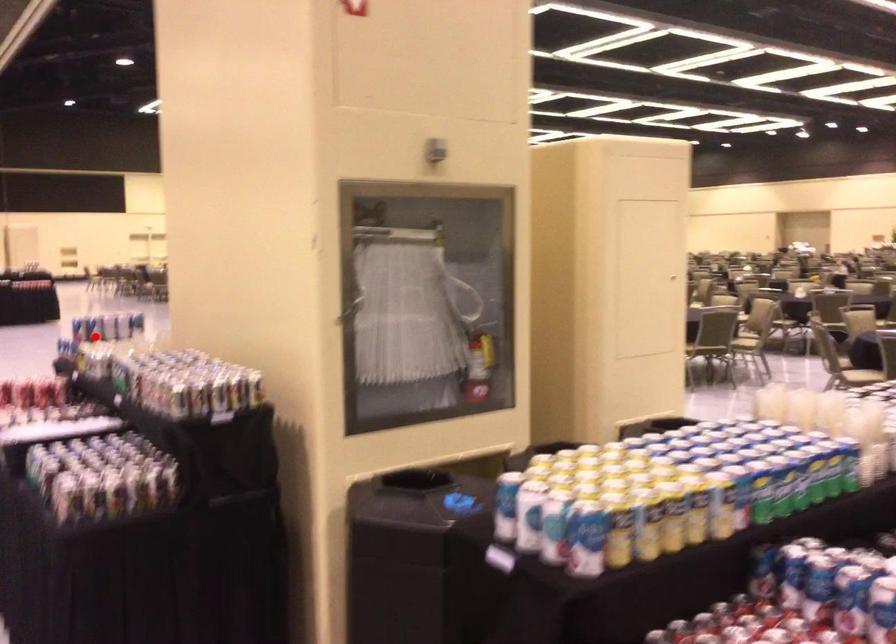
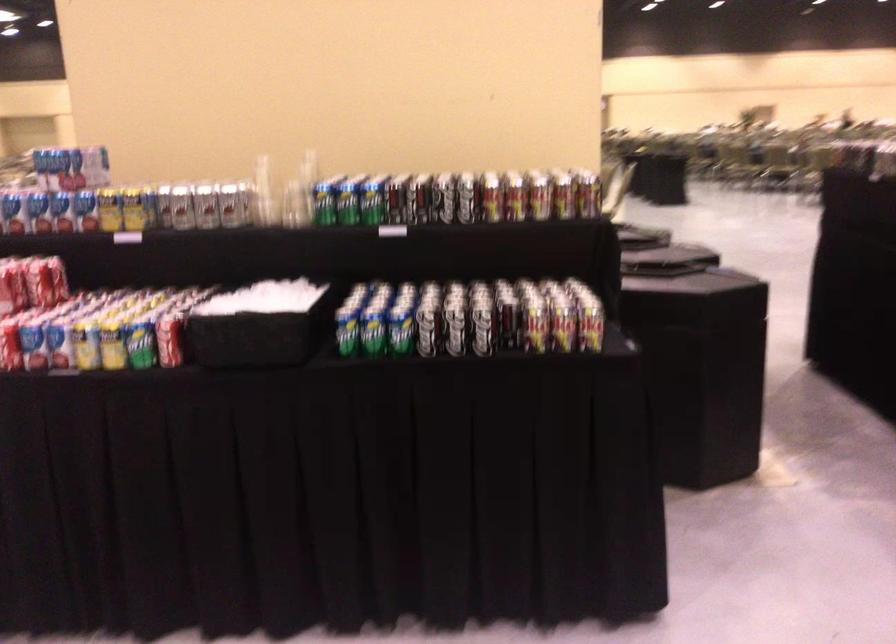
In the second image, find the point that corresponds to the highlighted location in the first image.

(108, 210)